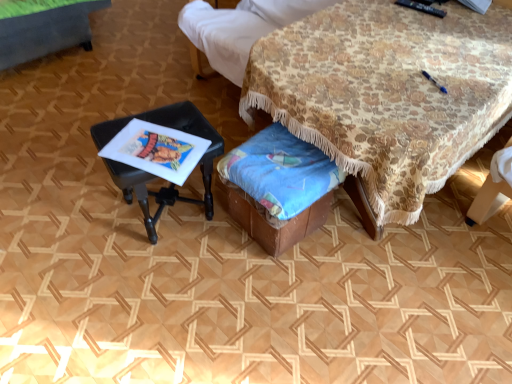
What is the approximate height of blue fabric at lower center?

blue fabric at lower center is 14.12 inches in height.

Measure the distance between point [278,171] and camera.

Point [278,171] and camera are 4.57 feet apart from each other.

Locate an element on the screen. The width and height of the screenshot is (512, 384). floral fabric table at center, the 1th table from the right is located at coordinates (386, 96).

Where is `blue fabric at lower center`? blue fabric at lower center is located at coordinates tap(280, 173).

The height and width of the screenshot is (384, 512). Find the location of `table below the floral fabric table at center, the 1th table from the right (from a real-world perspective)`. table below the floral fabric table at center, the 1th table from the right (from a real-world perspective) is located at coordinates click(154, 175).

Is floral fabric table at center, marked as the 2th table in a left-to-right arrangement, looking in the opposite direction of black plastic stool at left, placed as the 2th table when sorted from right to left?

floral fabric table at center, marked as the 2th table in a left-to-right arrangement, does not have its back to black plastic stool at left, placed as the 2th table when sorted from right to left.

Which of these two, floral fabric table at center, marked as the 2th table in a left-to-right arrangement, or black plastic stool at left, arranged as the 1th table when viewed from the left, is smaller?

Smaller between the two is black plastic stool at left, arranged as the 1th table when viewed from the left.

Considering the relative sizes of floral fabric table at center, the 1th table from the right, and black plastic stool at left, placed as the 2th table when sorted from right to left, in the image provided, is floral fabric table at center, the 1th table from the right, thinner than black plastic stool at left, placed as the 2th table when sorted from right to left,?

No.

Between black plastic stool at left, placed as the 2th table when sorted from right to left, and blue fabric at lower center, which one appears on the right side from the viewer's perspective?

blue fabric at lower center.

Is black plastic stool at left, arranged as the 1th table when viewed from the left, turned away from blue fabric at lower center?

No, black plastic stool at left, arranged as the 1th table when viewed from the left, is not facing the opposite direction of blue fabric at lower center.

From the image's perspective, is black plastic stool at left, placed as the 2th table when sorted from right to left, located above or below blue fabric at lower center?

Based on their image positions, black plastic stool at left, placed as the 2th table when sorted from right to left, is located above blue fabric at lower center.

Is black plastic stool at left, arranged as the 1th table when viewed from the left, to the left or to the right of floral fabric table at center, the 1th table from the right, in the image?

In the image, black plastic stool at left, arranged as the 1th table when viewed from the left, appears on the left side of floral fabric table at center, the 1th table from the right.

How far apart are black plastic stool at left, arranged as the 1th table when viewed from the left, and floral fabric table at center, the 1th table from the right?

black plastic stool at left, arranged as the 1th table when viewed from the left, and floral fabric table at center, the 1th table from the right, are 23.51 inches apart from each other.

From the picture: From the image's perspective, relative to floral fabric table at center, marked as the 2th table in a left-to-right arrangement, is black plastic stool at left, arranged as the 1th table when viewed from the left, above or below?

From the image's perspective, black plastic stool at left, arranged as the 1th table when viewed from the left, appears below floral fabric table at center, marked as the 2th table in a left-to-right arrangement.

Identify the location of table in front of the blue fabric at lower center. (386, 96).

Is floral fabric table at center, marked as the 2th table in a left-to-right arrangement, closer to the viewer compared to blue fabric at lower center?

Yes, the depth of floral fabric table at center, marked as the 2th table in a left-to-right arrangement, is less than that of blue fabric at lower center.

Is floral fabric table at center, the 1th table from the right, aimed at blue fabric at lower center?

Yes.

Is floral fabric table at center, the 1th table from the right, touching blue fabric at lower center?

No, floral fabric table at center, the 1th table from the right, is not next to blue fabric at lower center.

From a real-world perspective, does blue fabric at lower center sit lower than black plastic stool at left, placed as the 2th table when sorted from right to left?

Indeed, from a real-world perspective, blue fabric at lower center is positioned beneath black plastic stool at left, placed as the 2th table when sorted from right to left.

Considering the positions of point (312, 168) and point (108, 141), is point (312, 168) closer or farther from the camera than point (108, 141)?

Point (312, 168) is closer to the camera than point (108, 141).

Which is more to the left, blue fabric at lower center or black plastic stool at left, arranged as the 1th table when viewed from the left?

black plastic stool at left, arranged as the 1th table when viewed from the left, is more to the left.

Does blue fabric at lower center have a lesser height compared to floral fabric table at center, the 1th table from the right?

Yes.

From the image's perspective, which is below, blue fabric at lower center or floral fabric table at center, marked as the 2th table in a left-to-right arrangement?

blue fabric at lower center, from the image's perspective.

Is blue fabric at lower center far away from floral fabric table at center, the 1th table from the right?

Actually, blue fabric at lower center and floral fabric table at center, the 1th table from the right, are a little close together.

Is blue fabric at lower center not within floral fabric table at center, the 1th table from the right?

Actually, blue fabric at lower center is at least partially inside floral fabric table at center, the 1th table from the right.

You are a GUI agent. You are given a task and a screenshot of the screen. Output one action in this format:
    pyautogui.click(x=<x>, y=<y>)
    Task: Click on the table lying on the left of floral fabric table at center, the 1th table from the right
    
    Given the screenshot: What is the action you would take?
    tap(154, 175)

Image resolution: width=512 pixels, height=384 pixels. What are the coordinates of `the 1st table above the blue fabric at lower center (from the image's perspective)` in the screenshot? It's located at coord(154,175).

Which object lies further to the anchor point black plastic stool at left, placed as the 2th table when sorted from right to left, blue fabric at lower center or floral fabric table at center, marked as the 2th table in a left-to-right arrangement?

floral fabric table at center, marked as the 2th table in a left-to-right arrangement, is positioned further to the anchor black plastic stool at left, placed as the 2th table when sorted from right to left.

When comparing their distances from floral fabric table at center, the 1th table from the right, does black plastic stool at left, placed as the 2th table when sorted from right to left, or blue fabric at lower center seem further?

Based on the image, black plastic stool at left, placed as the 2th table when sorted from right to left, appears to be further to floral fabric table at center, the 1th table from the right.

Which object lies further to the anchor point blue fabric at lower center, black plastic stool at left, placed as the 2th table when sorted from right to left, or floral fabric table at center, marked as the 2th table in a left-to-right arrangement?

floral fabric table at center, marked as the 2th table in a left-to-right arrangement, is further to blue fabric at lower center.

Looking at the image, which one is located further to floral fabric table at center, marked as the 2th table in a left-to-right arrangement, blue fabric at lower center or black plastic stool at left, arranged as the 1th table when viewed from the left?

The object further to floral fabric table at center, marked as the 2th table in a left-to-right arrangement, is black plastic stool at left, arranged as the 1th table when viewed from the left.

Based on their spatial positions, is floral fabric table at center, the 1th table from the right, or black plastic stool at left, placed as the 2th table when sorted from right to left, further from blue fabric at lower center?

floral fabric table at center, the 1th table from the right, is further to blue fabric at lower center.

Based on their spatial positions, is floral fabric table at center, marked as the 2th table in a left-to-right arrangement, or blue fabric at lower center closer to black plastic stool at left, placed as the 2th table when sorted from right to left?

blue fabric at lower center.

I want to click on blanket between black plastic stool at left, arranged as the 1th table when viewed from the left, and floral fabric table at center, marked as the 2th table in a left-to-right arrangement, in the horizontal direction, so click(280, 173).